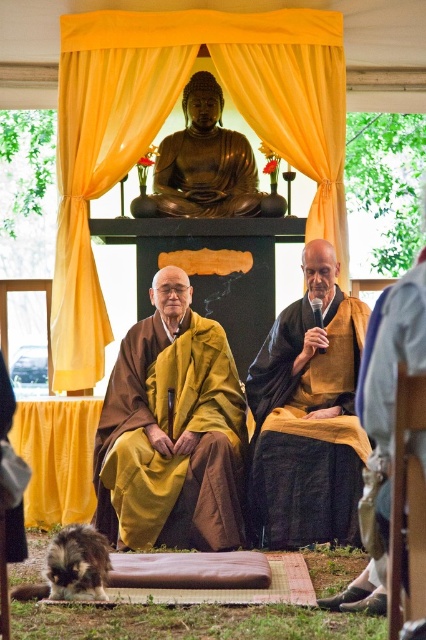
Based on the coordinates provided, where is the yellow matte robe at center located in the image?

The yellow matte robe at center is located at the coordinates point (x=173, y=438).

You are standing at the point labeled point (127,369) and want to walk towards the point labeled point (385,592). Will you be moving forward or backward relative to your current position?

Since point (127,369) is behind point (385,592), moving from point (127,369) towards point (385,592) would mean moving forward relative to your current position.